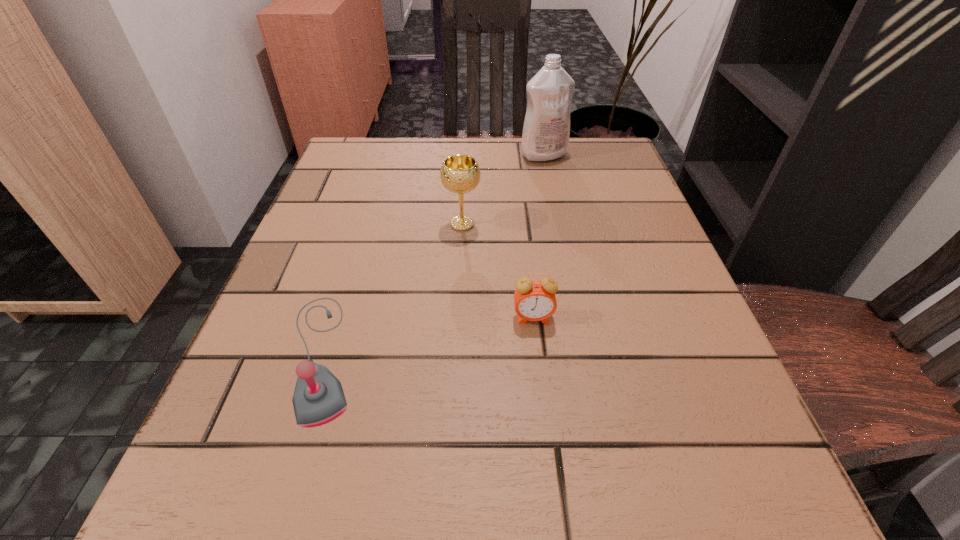
I want to click on object that is at the far edge, so [x=546, y=130].

Where is `object at the left edge`? object at the left edge is located at coordinates (318, 398).

What are the coordinates of `object present at the right edge` in the screenshot? It's located at (546, 130).

This screenshot has width=960, height=540. In order to click on object that is positioned at the far right corner in this screenshot , I will do `click(546, 130)`.

The width and height of the screenshot is (960, 540). I want to click on vacant space at the far edge of the desktop, so click(x=499, y=145).

This screenshot has width=960, height=540. I want to click on free space at the near edge of the desktop, so click(x=527, y=494).

Locate an element on the screen. This screenshot has height=540, width=960. vacant space at the left edge is located at coordinates (344, 371).

Where is `vacant space at the right edge of the desktop`? vacant space at the right edge of the desktop is located at coordinates (692, 392).

What are the coordinates of `free location at the far left corner of the desktop` in the screenshot? It's located at (392, 153).

The height and width of the screenshot is (540, 960). I want to click on vacant space at the near left corner, so click(x=277, y=489).